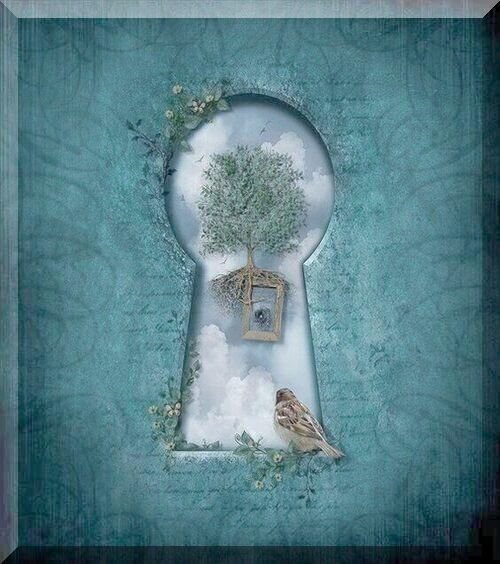
Identify the location of bottom of keyhole. (235, 455).